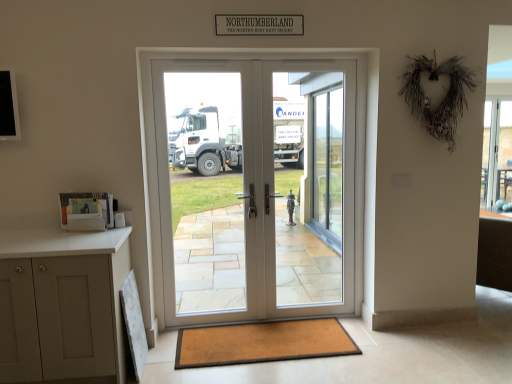
Question: Is clear glass window at right turned away from white glossy screen door at center, acting as the second screen door starting from the left?

Choices:
 (A) no
 (B) yes

Answer: (A)

Question: Is clear glass window at right positioned beyond the bounds of white glossy screen door at center, positioned as the 1th screen door in right-to-left order?

Choices:
 (A) yes
 (B) no

Answer: (A)

Question: Is clear glass window at right facing towards white glossy screen door at center, acting as the second screen door starting from the left?

Choices:
 (A) yes
 (B) no

Answer: (B)

Question: From the image's perspective, is clear glass window at right located above white glossy screen door at center, acting as the second screen door starting from the left?

Choices:
 (A) no
 (B) yes

Answer: (B)

Question: Can you see clear glass window at right touching white glossy screen door at center, positioned as the 1th screen door in right-to-left order?

Choices:
 (A) yes
 (B) no

Answer: (B)

Question: Considering the relative sizes of clear glass window at right and white glossy screen door at center, acting as the second screen door starting from the left, in the image provided, is clear glass window at right taller than white glossy screen door at center, acting as the second screen door starting from the left,?

Choices:
 (A) no
 (B) yes

Answer: (A)

Question: Considering the relative sizes of brown textured mat at lower center and white glossy door at center, which is the first screen door in left-to-right order, in the image provided, is brown textured mat at lower center bigger than white glossy door at center, which is the first screen door in left-to-right order,?

Choices:
 (A) yes
 (B) no

Answer: (B)

Question: Is brown textured mat at lower center touching white glossy door at center, the second screen door positioned from the right?

Choices:
 (A) yes
 (B) no

Answer: (B)

Question: Can you confirm if brown textured mat at lower center is taller than white glossy door at center, which is the first screen door in left-to-right order?

Choices:
 (A) yes
 (B) no

Answer: (B)

Question: From the image's perspective, is brown textured mat at lower center beneath white glossy door at center, the second screen door positioned from the right?

Choices:
 (A) no
 (B) yes

Answer: (B)

Question: Can you confirm if brown textured mat at lower center is thinner than white glossy door at center, the second screen door positioned from the right?

Choices:
 (A) no
 (B) yes

Answer: (A)

Question: Considering the relative sizes of brown textured mat at lower center and white glossy door at center, the second screen door positioned from the right, in the image provided, is brown textured mat at lower center smaller than white glossy door at center, the second screen door positioned from the right,?

Choices:
 (A) yes
 (B) no

Answer: (A)

Question: Does white glossy door at center, the second screen door positioned from the right, come behind brown textured mat at lower center?

Choices:
 (A) no
 (B) yes

Answer: (B)